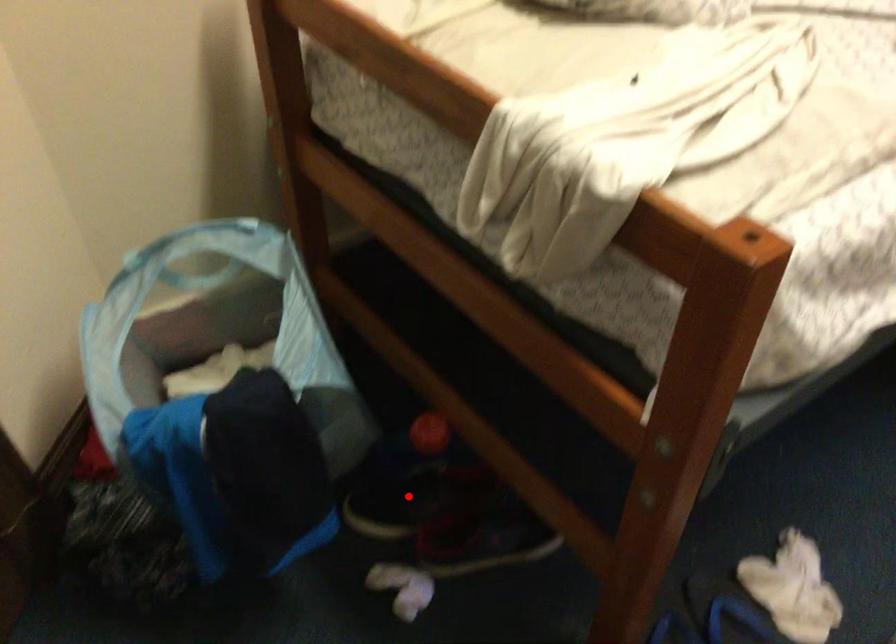
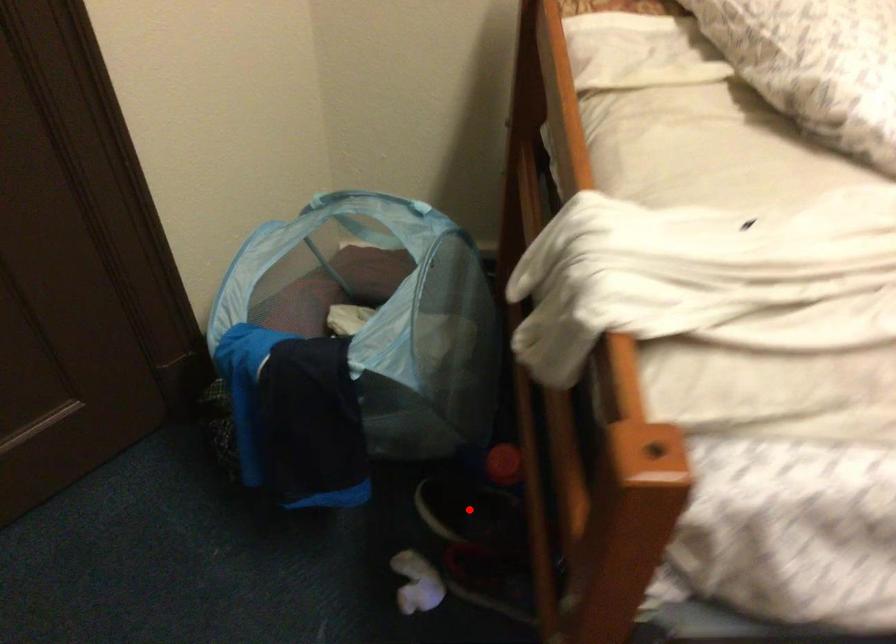
I am providing you with two images of the same scene from different viewpoints. A red point is marked on the first image and another point is marked on the second image. Does the point marked in image1 correspond to the same location as the one in image2?

Yes